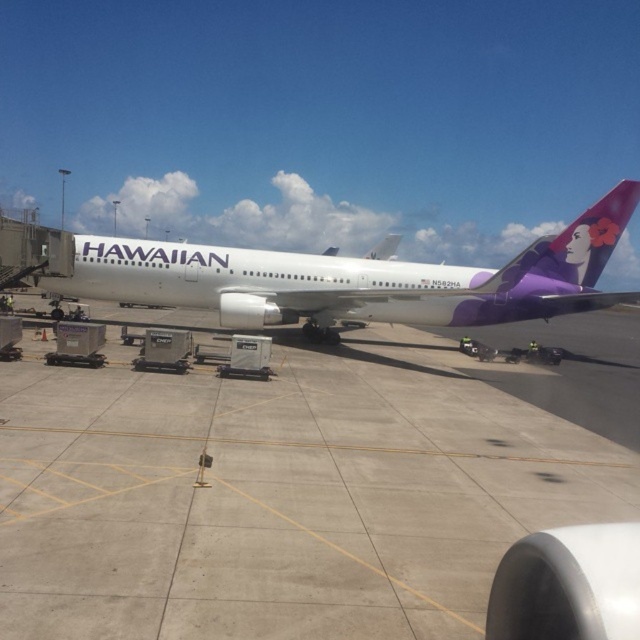
You are a maintenance worker at the airport and need to park another airplane of the same size as the white glossy airplane at center. The new airplane requires a parking spot that is wider than the current one. Based on the scene, is there enough space on the concrete at center to accommodate the new airplane?

The concrete at center is narrower than the white glossy airplane at center, so it cannot accommodate a new airplane of the same size that requires a wider parking spot.

You are a pilot standing at the airport gate. You need to determine if the concrete at center can support the weight of the white glossy airplane at center. Can you confirm this?

The concrete at center is shorter than the white glossy airplane at center, but this information does not indicate its load capacity. You should consult the airport specifications for confirmation.

You are a pilot standing on the concrete at center. You need to board the white glossy airplane at center. Which direction should you walk to reach the airplane?

The concrete at center is located below the white glossy airplane at center, so you should walk upwards to reach the airplane.